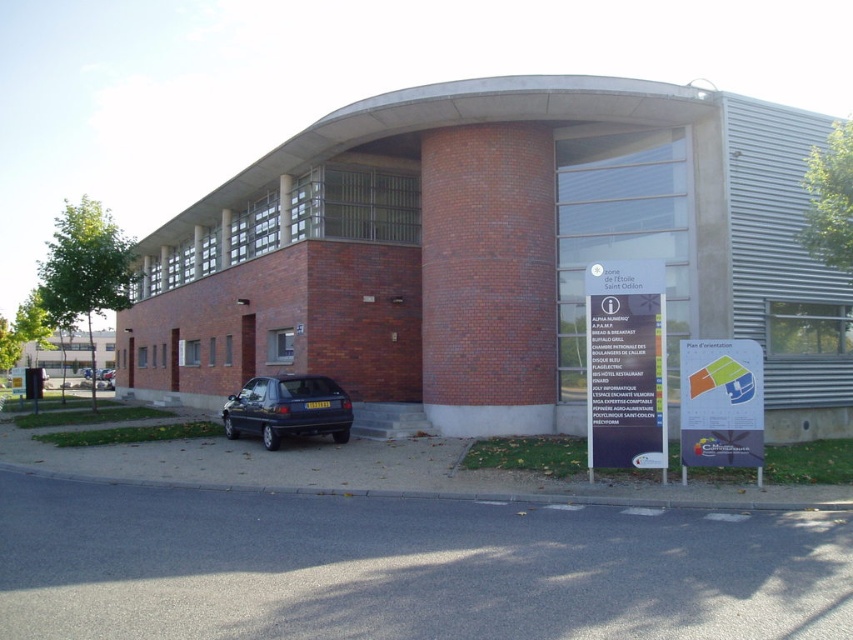
Image resolution: width=853 pixels, height=640 pixels. What do you see at coordinates (497, 252) in the screenshot?
I see `brick building at center` at bounding box center [497, 252].

Between brick building at center and white plastic sign at lower right, which one has less height?

With less height is white plastic sign at lower right.

Is point (367, 125) closer to viewer compared to point (761, 465)?

No, it is not.

The width and height of the screenshot is (853, 640). What are the coordinates of `brick building at center` in the screenshot? It's located at (497, 252).

Is white plastic sign at lower right positioned behind matte dark blue hatchback at lower left?

No, white plastic sign at lower right is in front of matte dark blue hatchback at lower left.

Between white plastic sign at lower right and matte dark blue hatchback at lower left, which one has less height?

With less height is matte dark blue hatchback at lower left.

Find the location of a particular element. The image size is (853, 640). white plastic sign at lower right is located at coordinates [x=720, y=403].

Does point (653, 360) come behind point (273, 426)?

No, it is not.

Which is more to the right, white plastic sign at center or matte dark blue hatchback at lower left?

white plastic sign at center is more to the right.

Between point (601, 426) and point (296, 392), which one is positioned behind?

The point (296, 392) is behind.

Where is `white plastic sign at center`? This screenshot has height=640, width=853. white plastic sign at center is located at coordinates (625, 364).